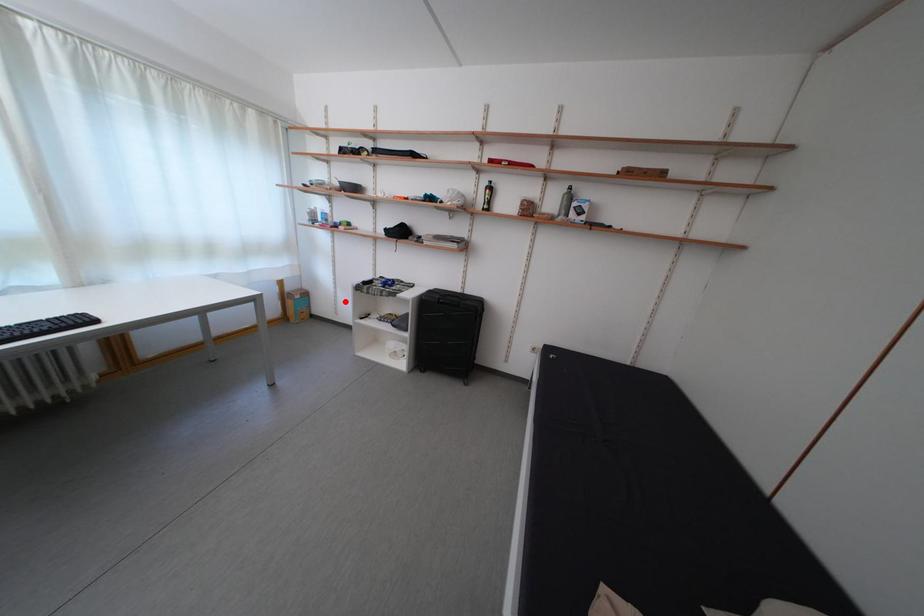
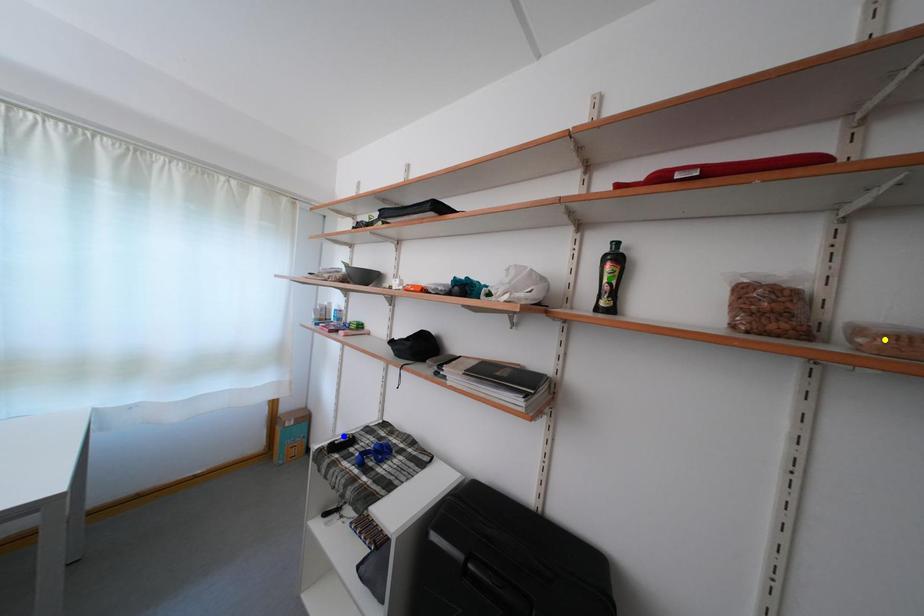
Question: I am providing you with two images of the same scene from different viewpoints. A red point is marked on the first image. You are given multiple points on the second image. Which spot in image 2 lines up with the point in image 1?

Choices:
 (A) green point
 (B) blue point
 (C) yellow point

Answer: (B)